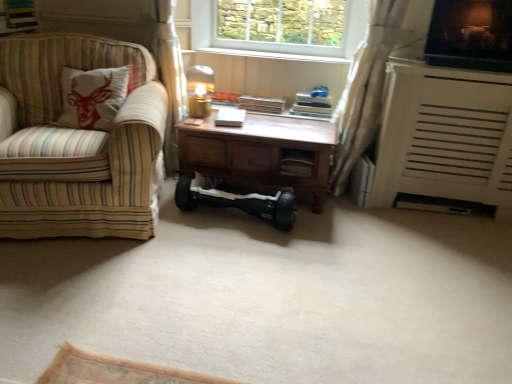
At what (x,y) coordinates should I click in order to perform the action: click on vacant region above white wood at upper center (from a real-world perspective). Please return your answer as a coordinate pair (x, y). This screenshot has width=512, height=384. Looking at the image, I should click on (267, 52).